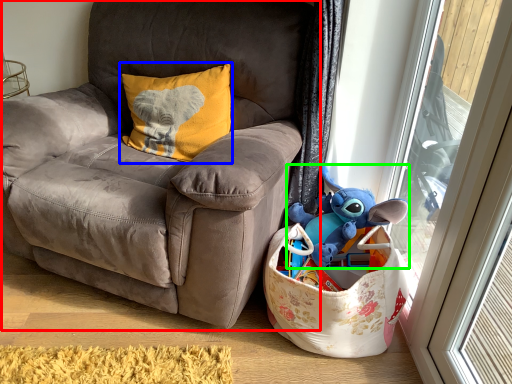
Question: Considering the real-world distances, which object is closest to chair (highlighted by a red box)? pillow (highlighted by a blue box) or toy (highlighted by a green box).

Choices:
 (A) pillow
 (B) toy

Answer: (A)